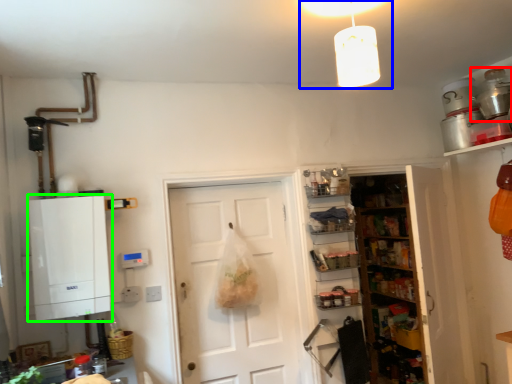
Question: Estimate the real-world distances between objects in this image. Which object is farther from appliance (highlighted by a red box), light fixture (highlighted by a blue box) or cabinetry (highlighted by a green box)?

Choices:
 (A) light fixture
 (B) cabinetry

Answer: (B)